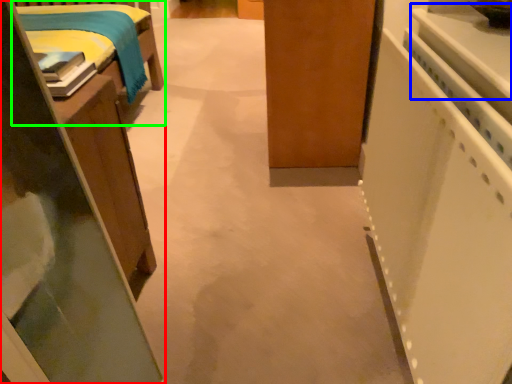
Question: Considering the real-world distances, which object is farthest from furniture (highlighted by a red box)? counter top (highlighted by a blue box) or furniture (highlighted by a green box)?

Choices:
 (A) counter top
 (B) furniture

Answer: (B)